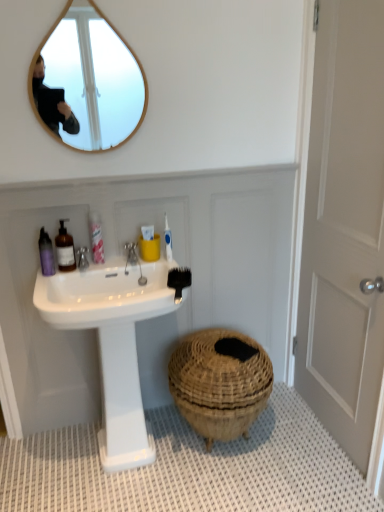
At what (x,y) coordinates should I click in order to perform the action: click on free space above brown woven basket at lower center (from a real-world perspective). Please return your answer as a coordinate pair (x, y). Image resolution: width=384 pixels, height=512 pixels. Looking at the image, I should click on (226, 350).